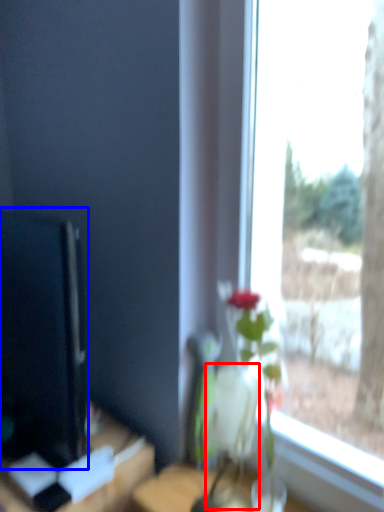
Question: Which object is further to the camera taking this photo, vase (highlighted by a red box) or computer monitor (highlighted by a blue box)?

Choices:
 (A) vase
 (B) computer monitor

Answer: (A)